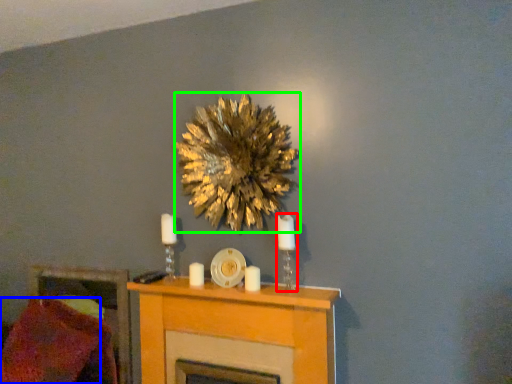
Question: Which is nearer to the candle holder (highlighted by a red box)? pillow (highlighted by a blue box) or flower (highlighted by a green box).

Choices:
 (A) pillow
 (B) flower

Answer: (B)